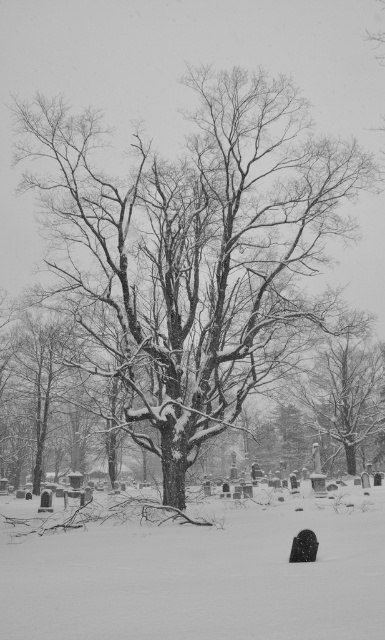
Does snow-covered bark tree at center lie in front of white powdery snow at center?

That is False.

Image resolution: width=385 pixels, height=640 pixels. I want to click on snow-covered bark tree at center, so click(192, 250).